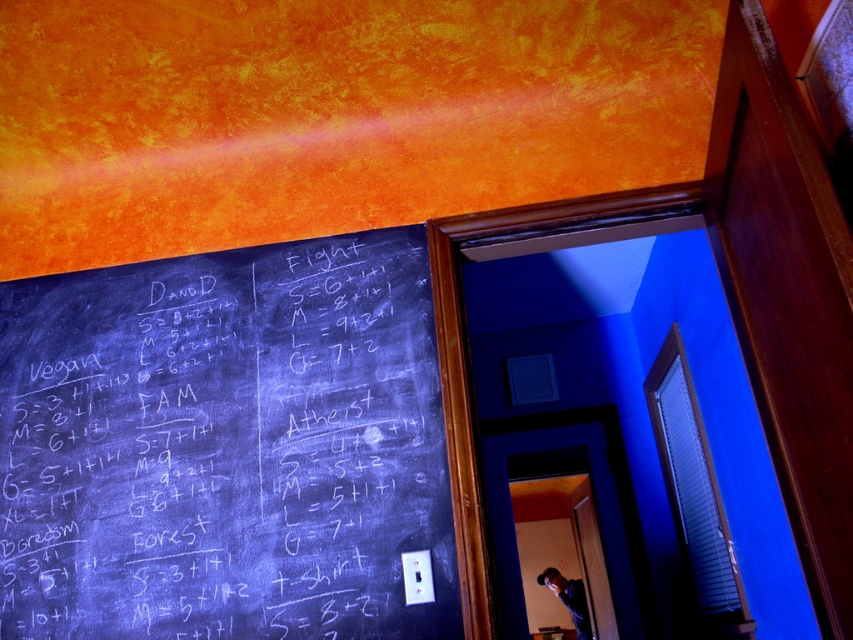
You are standing in the room and want to write on the black chalkboard at left while wearing the matte black shirt at center. Which item is closer to you so you can reach it first?

The black chalkboard at left is closer to the viewer than the matte black shirt at center, so you can reach the black chalkboard at left first.

You are standing in the room and want to hang a picture frame that is 1.2 meters wide. The frame must be placed either on the black chalkboard at left or the matte black shirt at center. Which surface can accommodate the frame without exceeding its width?

The black chalkboard at left is wider than the matte black shirt at center, so it can accommodate the 1.2 meter wide picture frame.

You are standing in the room with the chalkboard and want to touch both points on the chalkboard. Which point should you reach for first, point (91, 413) or point (585, 630)?

You should reach for point (91, 413) first because it is closer to you than point (585, 630).